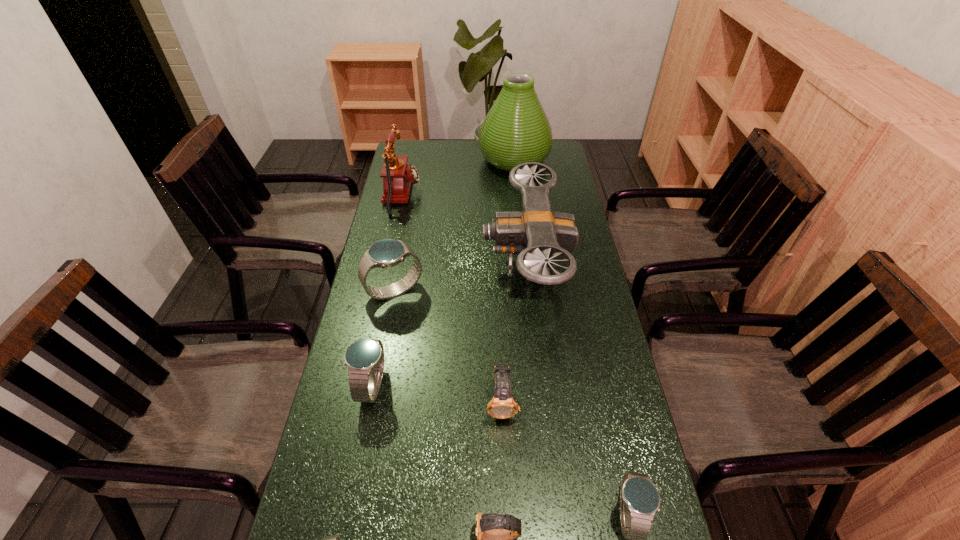
Locate an element on the screen. The height and width of the screenshot is (540, 960). vase is located at coordinates (516, 130).

Locate an element on the screen. The width and height of the screenshot is (960, 540). the tallest object is located at coordinates (516, 130).

Where is `telephone`? This screenshot has height=540, width=960. telephone is located at coordinates (398, 177).

This screenshot has width=960, height=540. Identify the location of drone. (535, 233).

This screenshot has width=960, height=540. What are the coordinates of `the farthest watch` in the screenshot? It's located at (385, 253).

Where is `the farthest blue watch`? the farthest blue watch is located at coordinates click(x=385, y=253).

Locate an element on the screen. The width and height of the screenshot is (960, 540). the second biggest blue watch is located at coordinates (364, 358).

This screenshot has width=960, height=540. I want to click on the bigger gold watch, so click(x=502, y=406).

You are a GUI agent. You are given a task and a screenshot of the screen. Output one action in this format:
    pyautogui.click(x=<x>, y=<y>)
    Task: Click on the vacant area situated on the front of the green vase
    The height and width of the screenshot is (540, 960).
    Given the screenshot: What is the action you would take?
    pyautogui.click(x=520, y=218)

Where is `vacant area located 0.380m on the dial of the telephone`? The height and width of the screenshot is (540, 960). vacant area located 0.380m on the dial of the telephone is located at coordinates (517, 195).